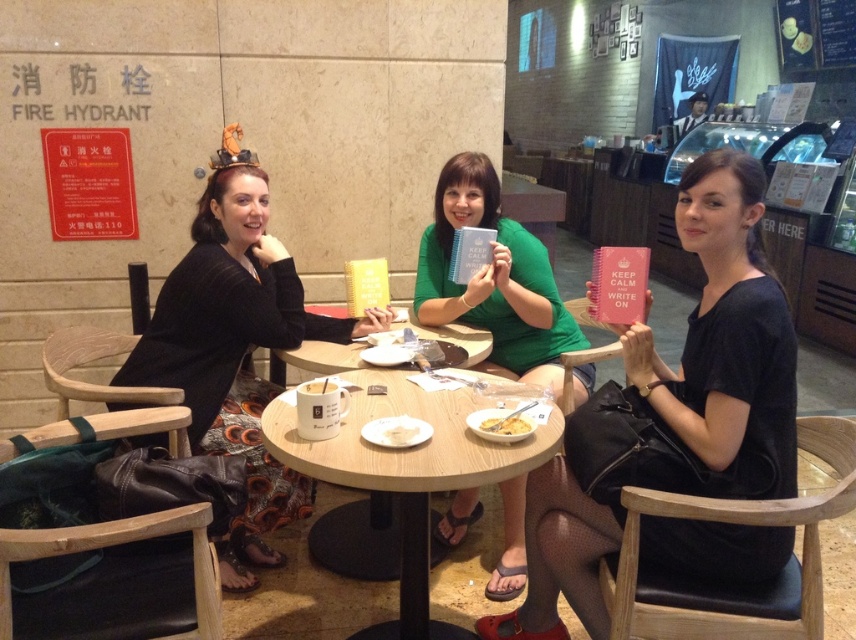
Question: Which object is farther from the camera taking this photo?

Choices:
 (A) matte black notebook at center
 (B) wooden table at center

Answer: (A)

Question: From the image, what is the correct spatial relationship of matte black notebook at center in relation to yellow creamy food at center?

Choices:
 (A) left
 (B) right

Answer: (B)

Question: Which object appears closest to the camera in this image?

Choices:
 (A) yellow creamy food at center
 (B) black textured sweater at left
 (C) white creamy dessert at center

Answer: (C)

Question: Which point is farther to the camera?

Choices:
 (A) (480, 420)
 (B) (384, 432)
 (C) (518, 300)

Answer: (C)

Question: Is black textured sweater at left further to camera compared to white creamy dessert at center?

Choices:
 (A) yes
 (B) no

Answer: (A)

Question: Is green matte notebook at center further to camera compared to white matte mug at center?

Choices:
 (A) no
 (B) yes

Answer: (B)